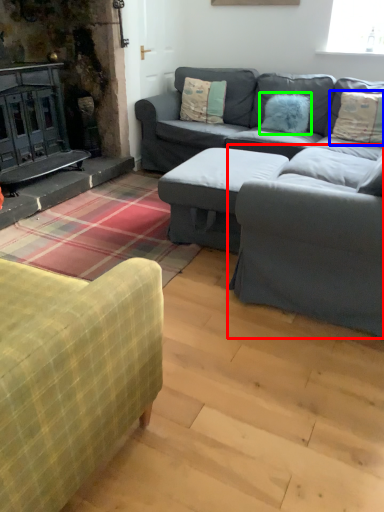
Question: Which object is the farthest from armchair (highlighted by a red box)? Choose among these: pillow (highlighted by a blue box) or pillow (highlighted by a green box).

Choices:
 (A) pillow
 (B) pillow

Answer: (B)